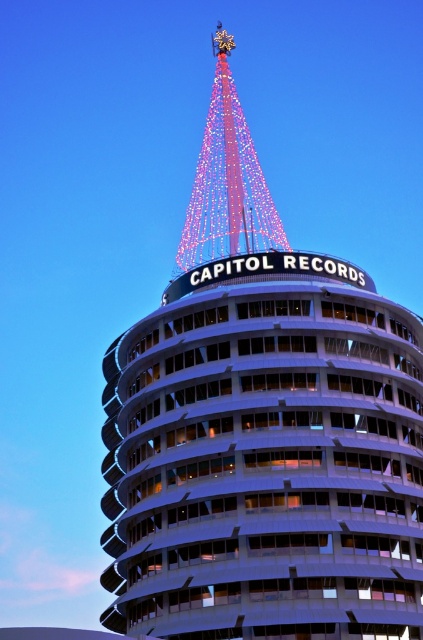
Does white glass tower at center have a lesser height compared to illuminated glass spire at upper center?

Indeed, white glass tower at center has a lesser height compared to illuminated glass spire at upper center.

Can you confirm if white glass tower at center is wider than illuminated glass spire at upper center?

Correct, the width of white glass tower at center exceeds that of illuminated glass spire at upper center.

Image resolution: width=423 pixels, height=640 pixels. I want to click on white glass tower at center, so click(x=261, y=429).

You are a GUI agent. You are given a task and a screenshot of the screen. Output one action in this format:
    pyautogui.click(x=<x>, y=<y>)
    Task: Click on the white glass tower at center
    The width and height of the screenshot is (423, 640).
    Given the screenshot: What is the action you would take?
    pyautogui.click(x=261, y=429)